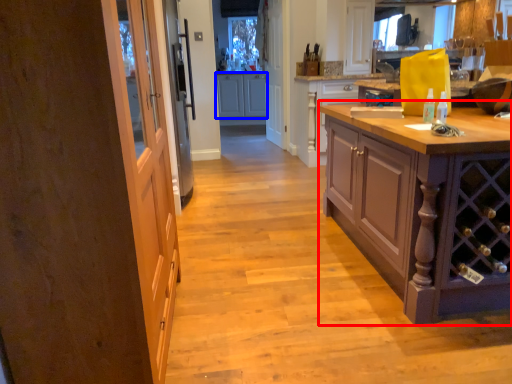
Question: Among these objects, which one is nearest to the camera, cabinetry (highlighted by a red box) or cabinetry (highlighted by a blue box)?

Choices:
 (A) cabinetry
 (B) cabinetry

Answer: (A)